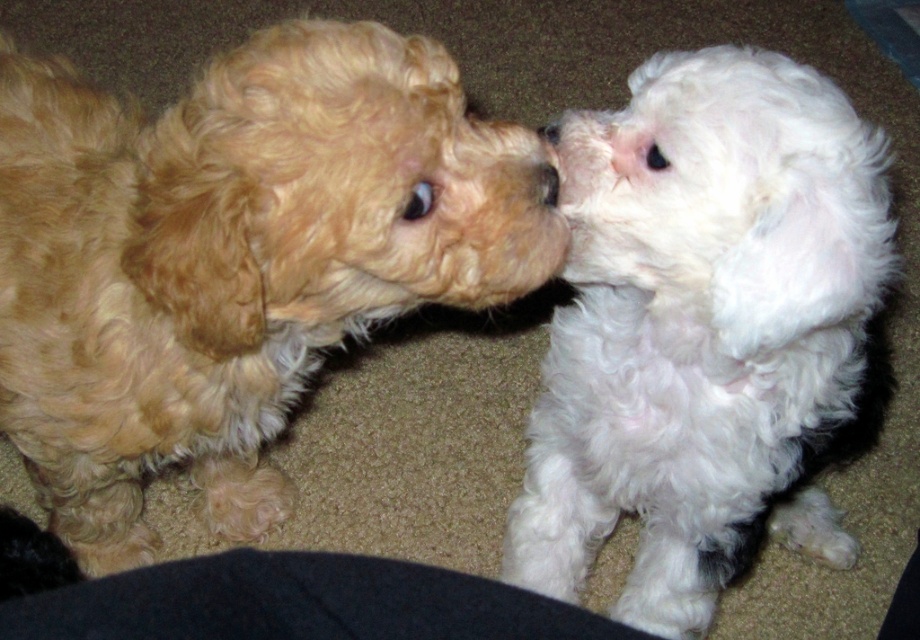
Does point (104, 122) come closer to viewer compared to point (566, 417)?

Yes, point (104, 122) is in front of point (566, 417).

Does golden curly fur dog at left appear under white fluffy dog at right?

Actually, golden curly fur dog at left is above white fluffy dog at right.

Where is `golden curly fur dog at left`? golden curly fur dog at left is located at coordinates (234, 259).

Identify the location of golden curly fur dog at left. The width and height of the screenshot is (920, 640). pos(234,259).